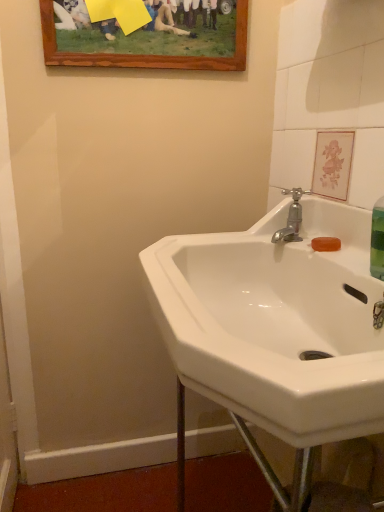
Question: Is silver metallic faucet at upper right wider than wooden picture frame at upper center?

Choices:
 (A) no
 (B) yes

Answer: (B)

Question: Is silver metallic faucet at upper right positioned in front of wooden picture frame at upper center?

Choices:
 (A) yes
 (B) no

Answer: (A)

Question: From a real-world perspective, is silver metallic faucet at upper right positioned over wooden picture frame at upper center based on gravity?

Choices:
 (A) no
 (B) yes

Answer: (A)

Question: Does silver metallic faucet at upper right have a larger size compared to wooden picture frame at upper center?

Choices:
 (A) no
 (B) yes

Answer: (A)

Question: Considering the relative positions of silver metallic faucet at upper right and wooden picture frame at upper center in the image provided, is silver metallic faucet at upper right behind wooden picture frame at upper center?

Choices:
 (A) no
 (B) yes

Answer: (A)

Question: From the image's perspective, is silver metallic faucet at upper right on top of wooden picture frame at upper center?

Choices:
 (A) yes
 (B) no

Answer: (B)

Question: Does wooden picture frame at upper center have a greater height compared to white glossy sink at center?

Choices:
 (A) no
 (B) yes

Answer: (A)

Question: Considering the relative sizes of wooden picture frame at upper center and white glossy sink at center in the image provided, is wooden picture frame at upper center bigger than white glossy sink at center?

Choices:
 (A) no
 (B) yes

Answer: (A)

Question: Does wooden picture frame at upper center have a lesser width compared to white glossy sink at center?

Choices:
 (A) no
 (B) yes

Answer: (B)

Question: Is the position of wooden picture frame at upper center less distant than that of white glossy sink at center?

Choices:
 (A) no
 (B) yes

Answer: (A)

Question: Could you tell me if wooden picture frame at upper center is facing white glossy sink at center?

Choices:
 (A) no
 (B) yes

Answer: (A)

Question: Is the depth of wooden picture frame at upper center greater than that of white glossy sink at center?

Choices:
 (A) no
 (B) yes

Answer: (B)

Question: Considering the relative sizes of white glossy sink at center and silver metallic faucet at upper right in the image provided, is white glossy sink at center taller than silver metallic faucet at upper right?

Choices:
 (A) yes
 (B) no

Answer: (A)